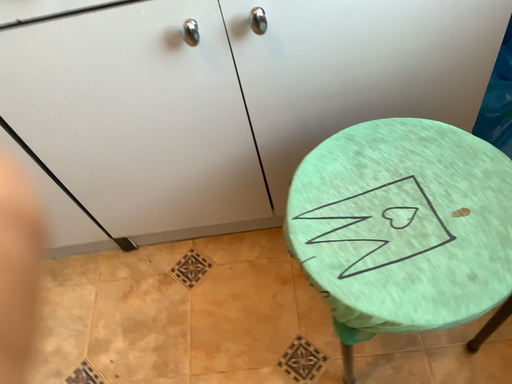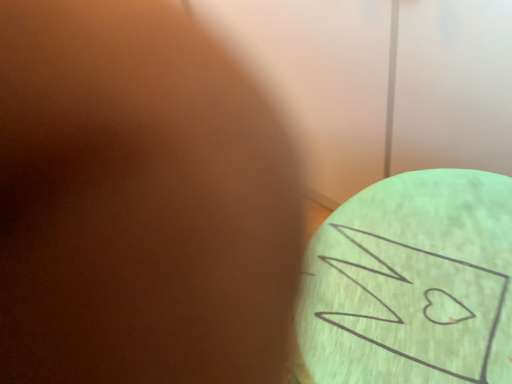
Question: Which way did the camera rotate in the video?

Choices:
 (A) rotated left
 (B) rotated right

Answer: (A)